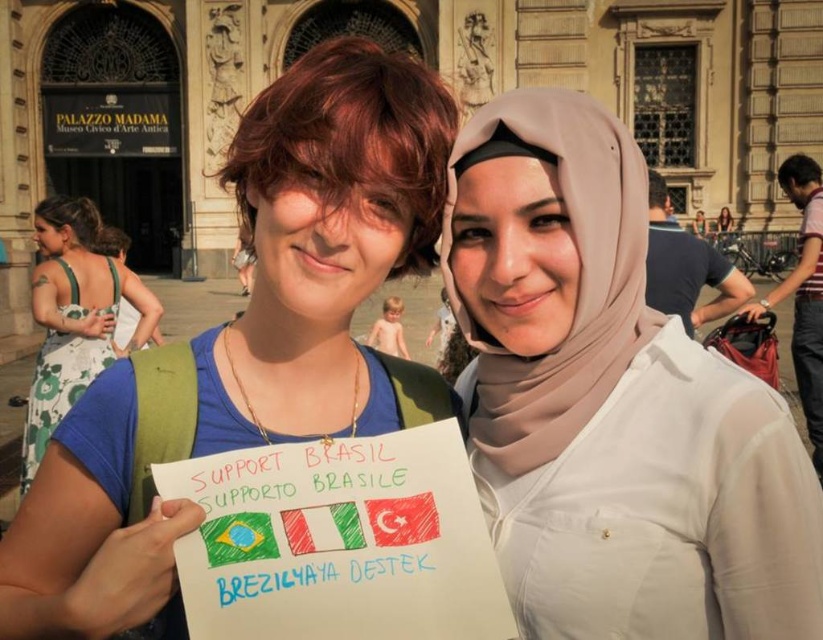
Question: Which point is closer to the camera taking this photo?

Choices:
 (A) (695, 216)
 (B) (22, 472)
 (C) (721, 216)
 (D) (523, 260)

Answer: (D)

Question: Can you confirm if white fabric hijab at upper center is positioned to the right of white cotton dress at center?

Choices:
 (A) yes
 (B) no

Answer: (A)

Question: Among these objects, which one is nearest to the camera?

Choices:
 (A) white fabric hijab at upper center
 (B) white cotton dress at center
 (C) green floral dress at left
 (D) matte blue shirt at center

Answer: (D)

Question: Which object is closer to the camera taking this photo?

Choices:
 (A) white fabric hijab at upper center
 (B) beige fabric hijab at center

Answer: (B)

Question: Is beige fabric hijab at center smaller than white cotton dress at center?

Choices:
 (A) no
 (B) yes

Answer: (A)

Question: Does beige fabric hijab at center have a larger size compared to white cotton dress at center?

Choices:
 (A) yes
 (B) no

Answer: (A)